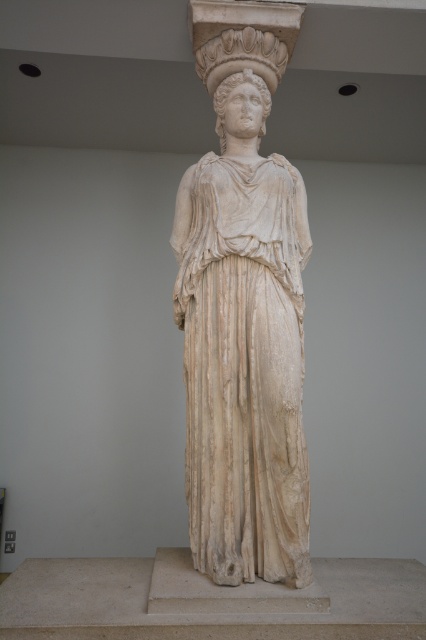
Is point (250, 492) more distant than point (229, 88)?

No, it is not.

Between white marble statue at center and white marble head at center, which one is positioned lower?

white marble statue at center is lower down.

Does point (215, 74) lie behind point (232, 83)?

Yes, it is behind point (232, 83).

Identify the location of white marble statue at center. (244, 324).